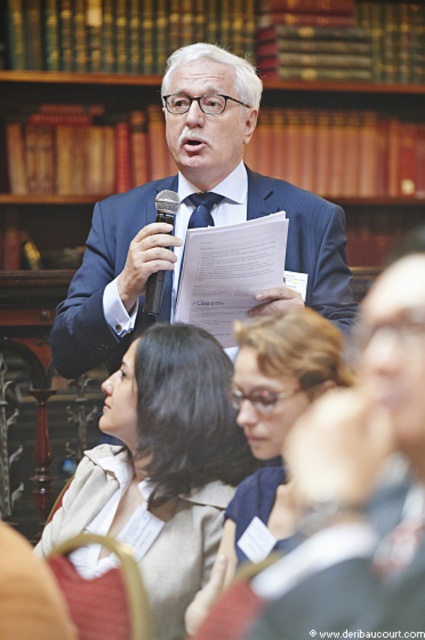
Question: Is matte blue shirt at center above black plastic microphone at upper center?

Choices:
 (A) no
 (B) yes

Answer: (A)

Question: Observing the image, what is the correct spatial positioning of blue suit at center in reference to black plastic microphone at upper center?

Choices:
 (A) right
 (B) left

Answer: (A)

Question: Which point appears farthest from the camera in this image?

Choices:
 (A) (176, 387)
 (B) (181, 220)

Answer: (B)

Question: Which object is farther from the camera taking this photo?

Choices:
 (A) smooth beige sweater at lower center
 (B) matte blue shirt at center

Answer: (A)

Question: Among these points, which one is farthest from the camera?

Choices:
 (A) (141, 236)
 (B) (192, 392)

Answer: (A)

Question: Does blue suit at center have a greater width compared to smooth beige sweater at lower center?

Choices:
 (A) no
 (B) yes

Answer: (B)